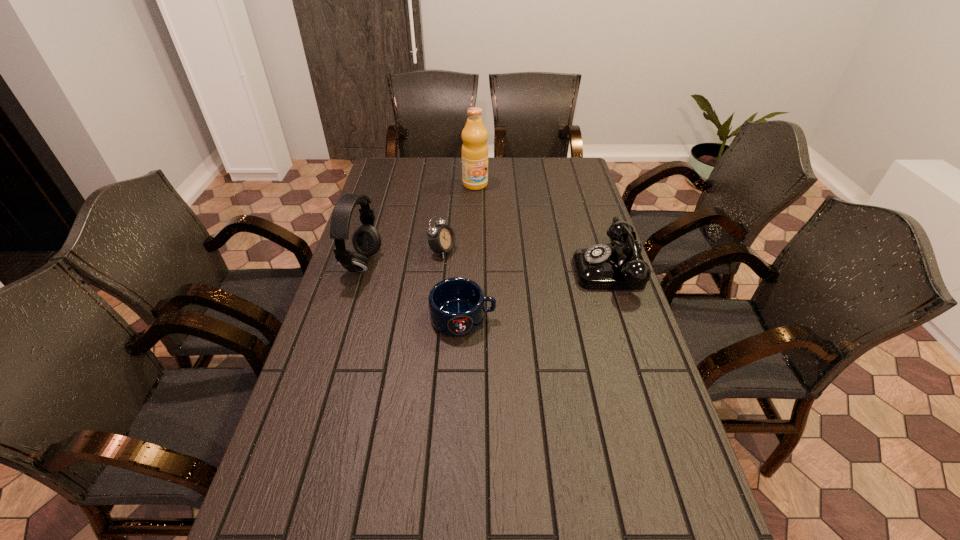
The image size is (960, 540). I want to click on free space located 0.380m on the dial of the rightmost object, so click(458, 269).

The height and width of the screenshot is (540, 960). Find the location of `vacant space situated on the ear cups of the fourth shortest object`. vacant space situated on the ear cups of the fourth shortest object is located at coordinates (488, 280).

Identify the location of vacant region located on the ear cups of the fourth shortest object. The height and width of the screenshot is (540, 960). (403, 271).

Locate an element on the screen. vacant area located on the ear cups of the fourth shortest object is located at coordinates (395, 270).

You are a GUI agent. You are given a task and a screenshot of the screen. Output one action in this format:
    pyautogui.click(x=<x>, y=<y>)
    Task: Click on the vacant space situated 0.370m on the face of the alarm clock
    This screenshot has height=540, width=960.
    Given the screenshot: What is the action you would take?
    pyautogui.click(x=559, y=287)

Locate an element on the screen. This screenshot has width=960, height=540. free space located 0.210m on the face of the alarm clock is located at coordinates (512, 272).

The width and height of the screenshot is (960, 540). In order to click on vacant space positioned 0.130m on the face of the alarm clock in this screenshot , I will do `click(489, 266)`.

Image resolution: width=960 pixels, height=540 pixels. I want to click on vacant space located on the front label of the tallest object, so click(x=492, y=207).

Identify the location of vacant space situated 0.340m on the front label of the tallest object. Image resolution: width=960 pixels, height=540 pixels. (515, 237).

You are a GUI agent. You are given a task and a screenshot of the screen. Output one action in this format:
    pyautogui.click(x=<x>, y=<y>)
    Task: Click on the blank space located 0.230m on the front label of the tallest object
    
    Given the screenshot: What is the action you would take?
    pyautogui.click(x=502, y=220)